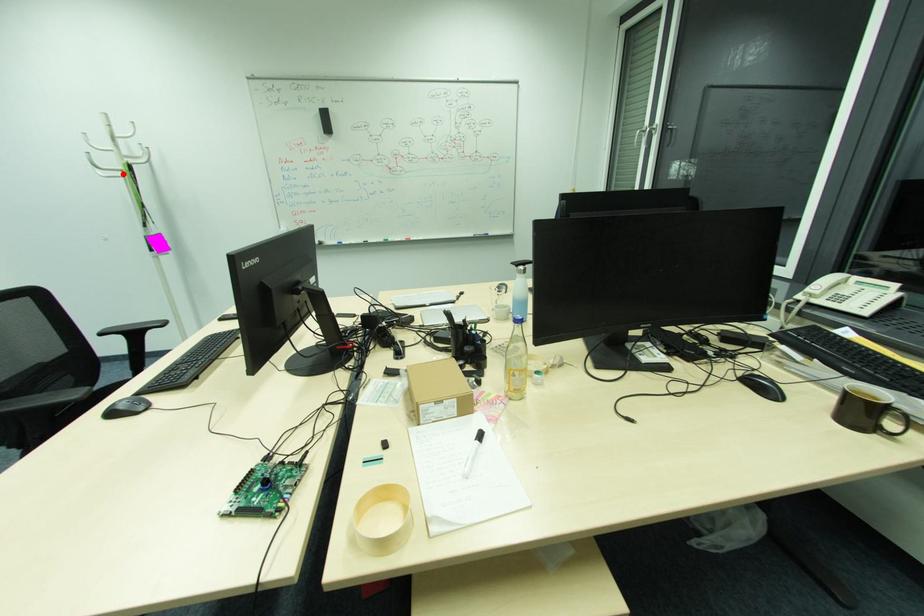
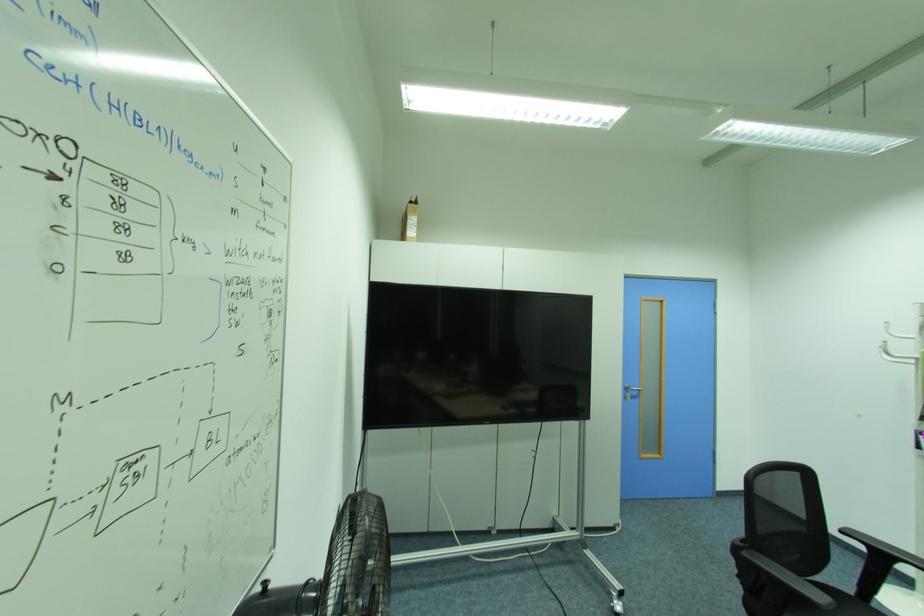
Locate, in the second image, the point that corresponds to the highlighted location in the first image.

(917, 361)